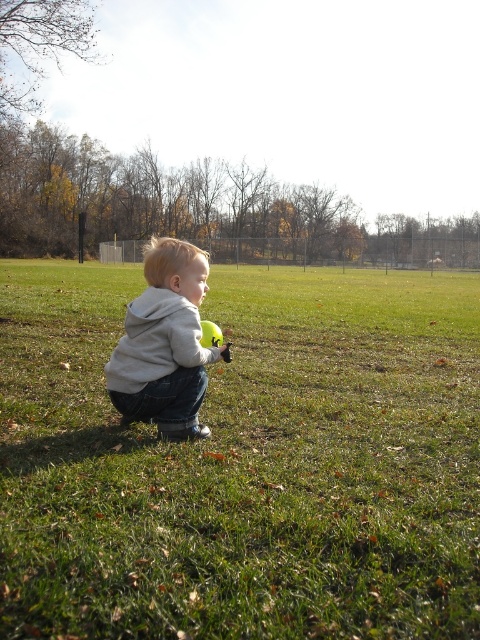
You are a drone operator trying to capture a photo of the child and the ball. The drone is currently positioned at point A, which is at coordinates point[239,280]. You need to adjust the drone to point B at coordinates point[164,348] to get a better angle. Will moving the drone from point A to point B bring it closer to the child?

Point point[239,280] is behind point point[164,348]. Moving the drone from point A to point B would bring it closer to the child because point B is in front of point A relative to the child.